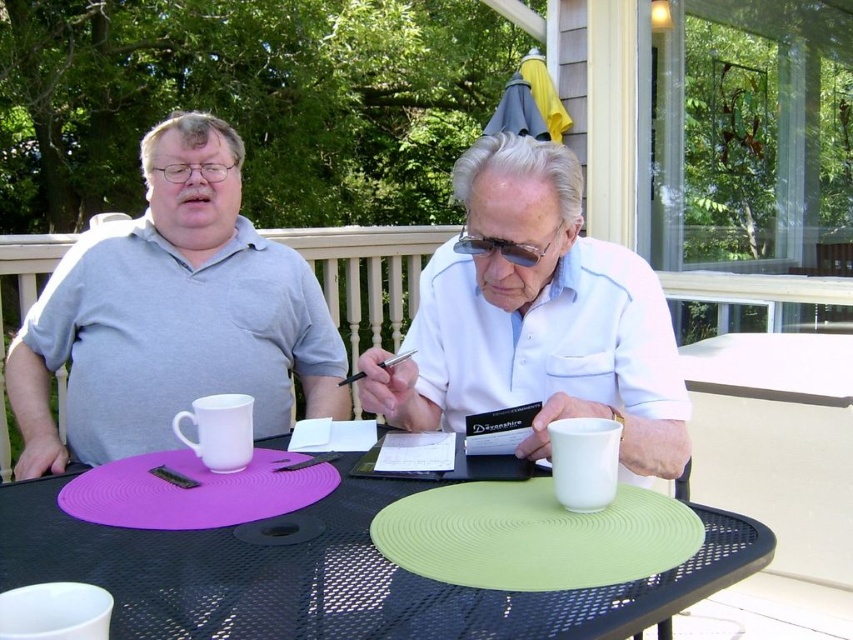
Measure the distance between point (181, 358) and camera.

Point (181, 358) and camera are 5.26 feet apart.

In the scene shown: Can you confirm if matte gray shirt at left is shorter than matte white mug at center?

In fact, matte gray shirt at left may be taller than matte white mug at center.

Based on the photo, measure the distance between matte gray shirt at left and camera.

The distance of matte gray shirt at left from camera is 4.67 feet.

This screenshot has height=640, width=853. Identify the location of matte gray shirt at left. (171, 316).

Is white matte shirt at center positioned in front of matte white mug at center?

Yes, white matte shirt at center is closer to the viewer.

Who is more distant from viewer, (x=579, y=262) or (x=257, y=340)?

Positioned behind is point (x=257, y=340).

Does point (540, 291) lie behind point (317, 394)?

That is False.

Where is `white matte shirt at center`? Image resolution: width=853 pixels, height=640 pixels. white matte shirt at center is located at coordinates (537, 317).

Is green rubber placemat at center bigger than white matte shirt at center?

No, green rubber placemat at center is not bigger than white matte shirt at center.

Is green rubber placemat at center further to the viewer compared to white matte shirt at center?

That is False.

Between point (532, 618) and point (543, 346), which one is positioned behind?

The point (543, 346) is behind.

Image resolution: width=853 pixels, height=640 pixels. Find the location of `green rubber placemat at center`. green rubber placemat at center is located at coordinates (332, 576).